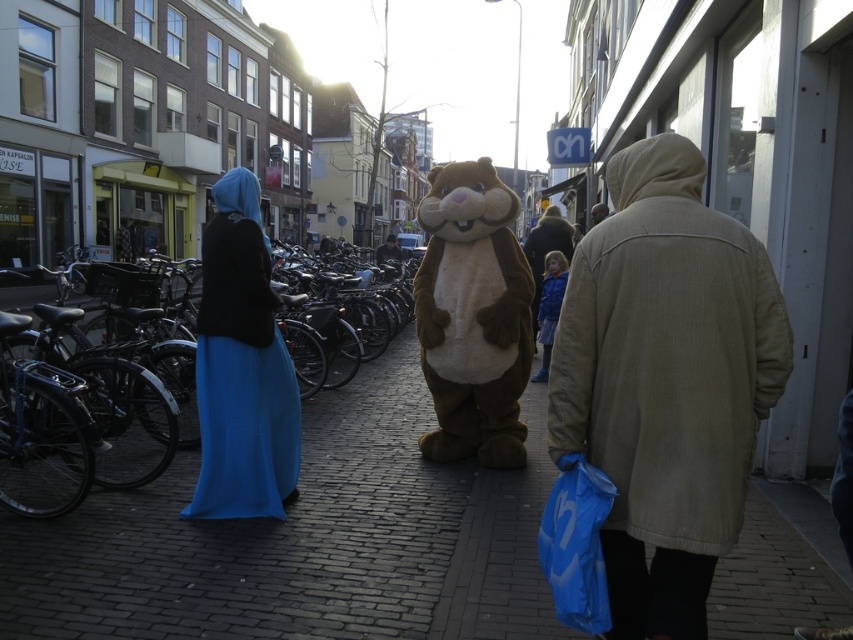
Question: Which object appears closest to the camera in this image?

Choices:
 (A) dark brown fur costume at center
 (B) blue fabric dress at left

Answer: (B)

Question: Does blue fabric dress at left come in front of blue fabric coat at center?

Choices:
 (A) yes
 (B) no

Answer: (A)

Question: Which is nearer to the blue fabric coat at center?

Choices:
 (A) blue fabric dress at left
 (B) fuzzy brown teddy at center

Answer: (B)

Question: Among these points, which one is farthest from the camera?

Choices:
 (A) (376, 260)
 (B) (740, 413)
 (C) (497, 412)

Answer: (A)

Question: Does blue corduroy jacket at center have a greater width compared to blue fabric coat at center?

Choices:
 (A) yes
 (B) no

Answer: (B)

Question: Is blue corduroy jacket at center smaller than blue fabric coat at center?

Choices:
 (A) yes
 (B) no

Answer: (A)